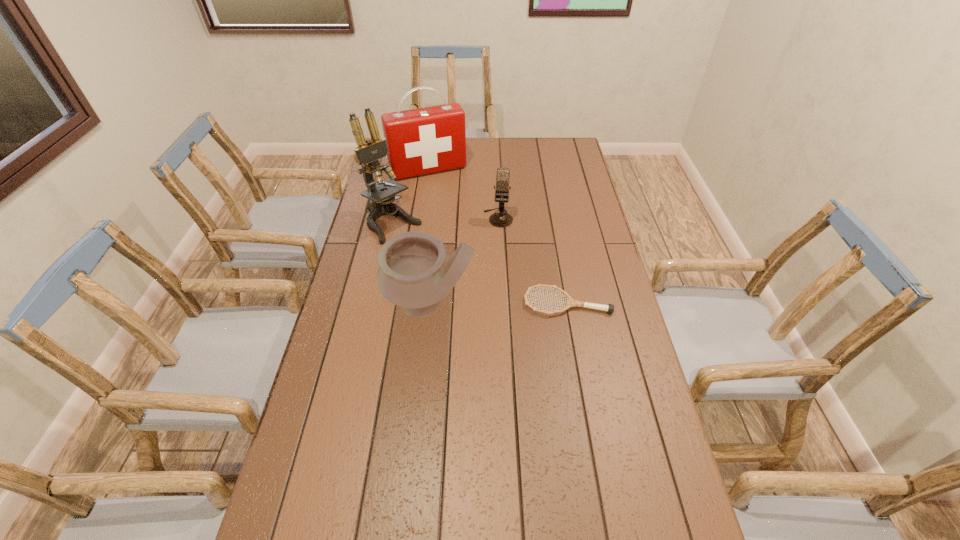
The height and width of the screenshot is (540, 960). What are the coordinates of `vacant space located 0.160m on the front face of the farthest object` in the screenshot? It's located at (450, 203).

I want to click on vacant space located 0.060m on the front face of the farthest object, so click(x=444, y=189).

Where is `vacant space located 0.100m on the front face of the farthest object`? This screenshot has width=960, height=540. vacant space located 0.100m on the front face of the farthest object is located at coordinates (446, 194).

What are the coordinates of `vacant space situated 0.320m on the front-facing side of the fourth tallest object` in the screenshot? It's located at (491, 291).

You are a GUI agent. You are given a task and a screenshot of the screen. Output one action in this format:
    pyautogui.click(x=<x>, y=<y>)
    Task: Click on the free space located 0.140m on the front-facing side of the fourth tallest object
    
    Given the screenshot: What is the action you would take?
    pyautogui.click(x=494, y=253)

Where is `free spot located 0.310m on the front-facing side of the fourth tallest object`? free spot located 0.310m on the front-facing side of the fourth tallest object is located at coordinates (491, 288).

The image size is (960, 540). I want to click on free space located at the eyepieces of the microscope, so click(472, 293).

Find the location of `free spot located 0.100m at the eyepieces of the microscope`. free spot located 0.100m at the eyepieces of the microscope is located at coordinates click(425, 254).

Locate an element on the screen. The width and height of the screenshot is (960, 540). vacant space located at the eyepieces of the microscope is located at coordinates (444, 269).

Locate an element on the screen. object present at the far edge is located at coordinates (422, 141).